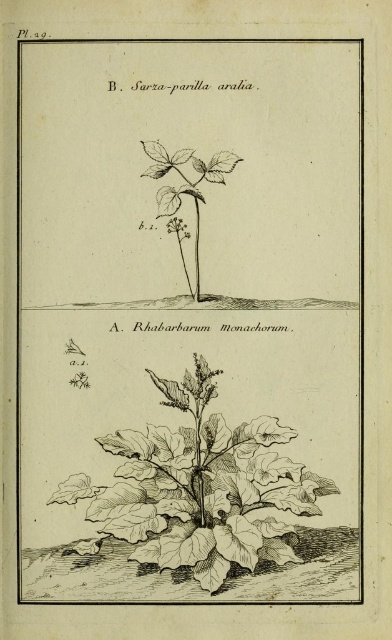
Looking at this image, how much distance is there between brown textured plant at lower center and green leafy plant at center?

brown textured plant at lower center and green leafy plant at center are 11.68 inches apart from each other.

Can you confirm if brown textured plant at lower center is positioned to the right of green leafy plant at center?

Indeed, brown textured plant at lower center is positioned on the right side of green leafy plant at center.

What do you see at coordinates (199, 490) in the screenshot? I see `brown textured plant at lower center` at bounding box center [199, 490].

You are a GUI agent. You are given a task and a screenshot of the screen. Output one action in this format:
    pyautogui.click(x=<x>, y=<y>)
    Task: Click on the brown textured plant at lower center
    
    Given the screenshot: What is the action you would take?
    pyautogui.click(x=199, y=490)